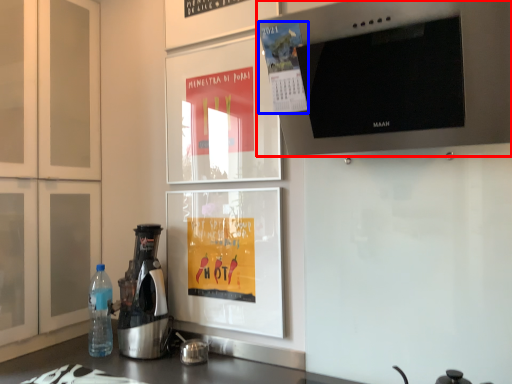
Question: Which object is closer to the camera taking this photo, home appliance (highlighted by a red box) or poster (highlighted by a blue box)?

Choices:
 (A) home appliance
 (B) poster

Answer: (A)